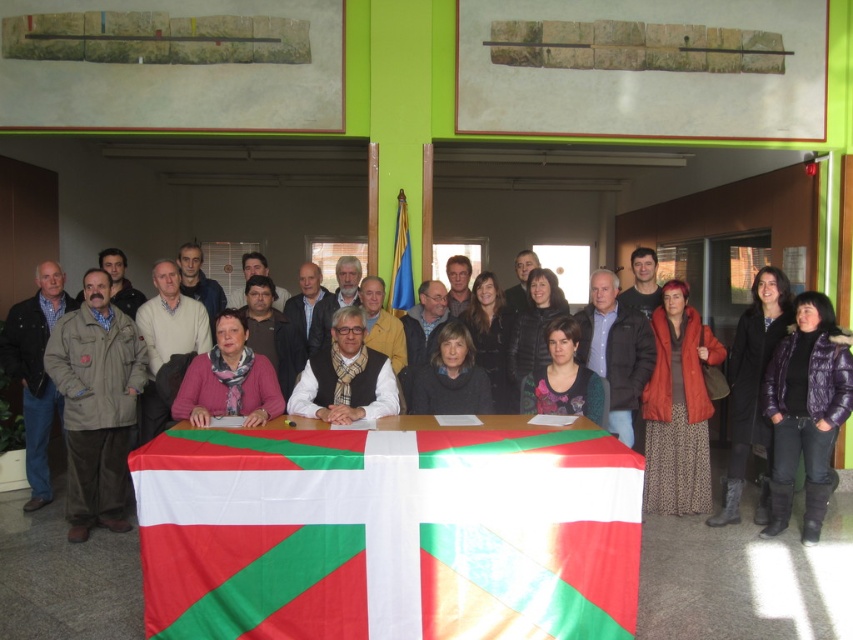
Question: Is purple quilted jacket at lower right in front of purple leather jacket at lower right?

Choices:
 (A) yes
 (B) no

Answer: (A)

Question: Estimate the real-world distances between objects in this image. Which object is closer to the red and white fabric flag at center?

Choices:
 (A) dark gray sweater at center
 (B) dark gray jacket at center
 (C) matte gray sweater at center
 (D) purple quilted jacket at lower right

Answer: (C)

Question: Can you confirm if red and white fabric flag at center is thinner than dark gray sweater at center?

Choices:
 (A) no
 (B) yes

Answer: (A)

Question: Can you confirm if purple quilted jacket at lower right is positioned below dark gray sweater at center?

Choices:
 (A) no
 (B) yes

Answer: (B)

Question: Among these points, which one is farthest from the camera?

Choices:
 (A) (701, 342)
 (B) (403, 296)

Answer: (B)

Question: Which point is farther from the camera taking this photo?

Choices:
 (A) (32, 502)
 (B) (589, 310)
 (C) (436, 378)
 (D) (222, 372)

Answer: (B)